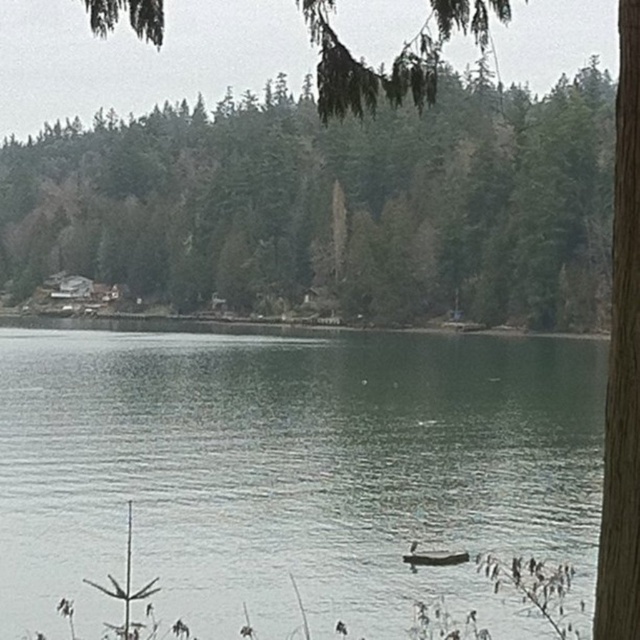
Question: Can you confirm if green matte tree at center is positioned to the right of green leafy tree at upper center?

Choices:
 (A) yes
 (B) no

Answer: (B)

Question: Which point is farther from the camera taking this photo?

Choices:
 (A) (106, 161)
 (B) (396, 584)
 (C) (388, 81)

Answer: (A)

Question: Is green smooth water at center smaller than green leafy tree at upper center?

Choices:
 (A) no
 (B) yes

Answer: (B)

Question: Estimate the real-world distances between objects in this image. Which object is closer to the green smooth water at center?

Choices:
 (A) green leafy tree at upper center
 (B) green matte tree at center

Answer: (A)

Question: Among these objects, which one is nearest to the camera?

Choices:
 (A) green smooth water at center
 (B) green matte tree at center
 (C) green leafy tree at upper center

Answer: (C)

Question: Can you confirm if green smooth water at center is positioned above green matte tree at center?

Choices:
 (A) no
 (B) yes

Answer: (A)